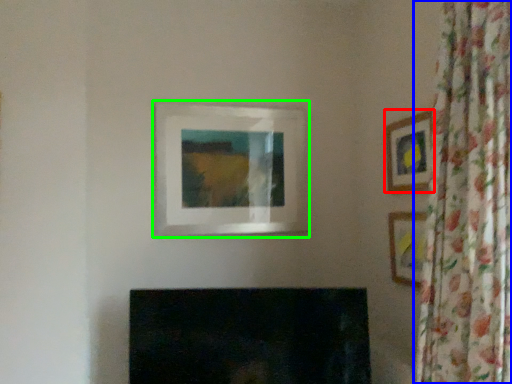
Question: Which is farther away from picture frame (highlighted by a red box)? curtain (highlighted by a blue box) or picture frame (highlighted by a green box)?

Choices:
 (A) curtain
 (B) picture frame

Answer: (B)